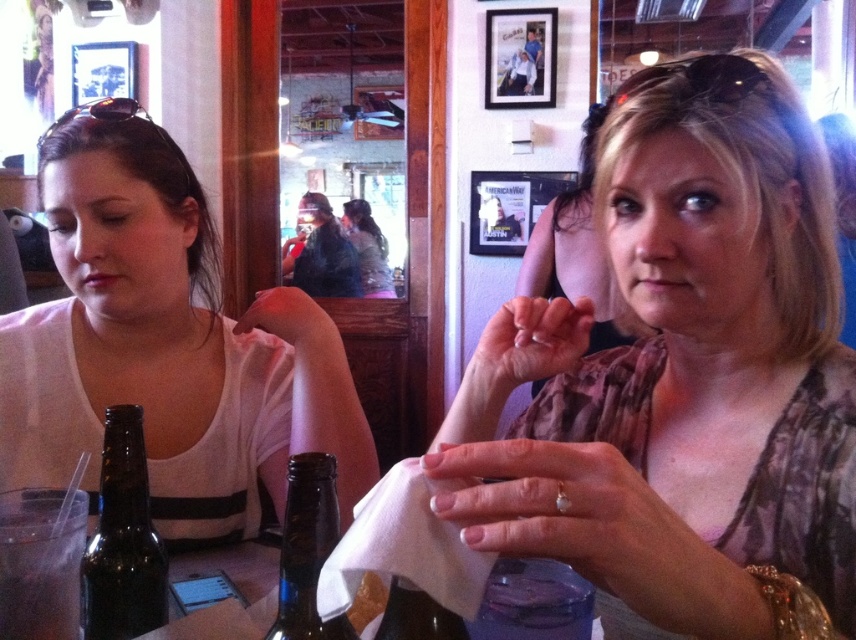
Which is more to the right, clear plastic cup at lower left or camouflage fabric blouse at upper right?

camouflage fabric blouse at upper right is more to the right.

Find the location of `clear plastic cup at lower left`. clear plastic cup at lower left is located at coordinates (39, 563).

Identify the location of clear plastic cup at lower left. The height and width of the screenshot is (640, 856). (39, 563).

Does brown glass bottle at lower left have a lesser width compared to dark brown leather jacket at center?

Correct, brown glass bottle at lower left's width is less than dark brown leather jacket at center's.

The image size is (856, 640). What do you see at coordinates (123, 540) in the screenshot?
I see `brown glass bottle at lower left` at bounding box center [123, 540].

Where is `brown glass bottle at lower left`? This screenshot has width=856, height=640. brown glass bottle at lower left is located at coordinates (123, 540).

Identify the location of brown glass bottle at lower left. The width and height of the screenshot is (856, 640). (123, 540).

Which of these two, white matte shirt at left or brown glass bottle at lower left, stands shorter?

With less height is brown glass bottle at lower left.

The image size is (856, 640). In order to click on white matte shirt at left in this screenshot , I will do `click(165, 342)`.